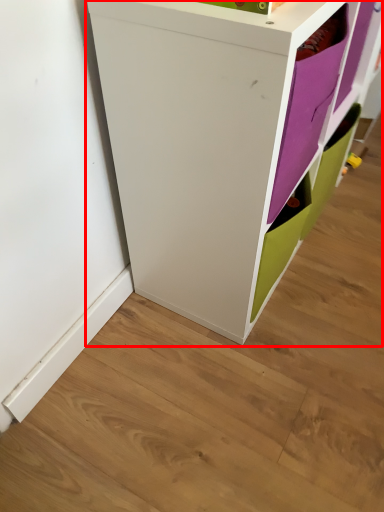
Question: From the image, what is the correct spatial relationship of cupboard (annotated by the red box) in relation to shelf?

Choices:
 (A) right
 (B) left

Answer: (B)